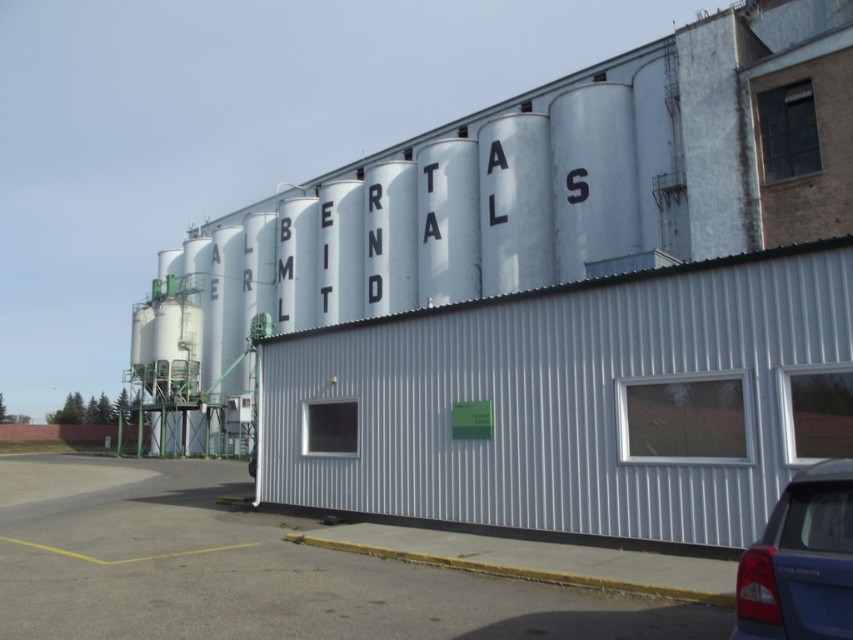
Is gray asphalt at lower left taller than blue matte sedan at lower right?

Yes, gray asphalt at lower left is taller than blue matte sedan at lower right.

Can you confirm if gray asphalt at lower left is smaller than blue matte sedan at lower right?

Incorrect, gray asphalt at lower left is not smaller in size than blue matte sedan at lower right.

Describe the element at coordinates (254, 570) in the screenshot. I see `gray asphalt at lower left` at that location.

Image resolution: width=853 pixels, height=640 pixels. I want to click on gray asphalt at lower left, so click(254, 570).